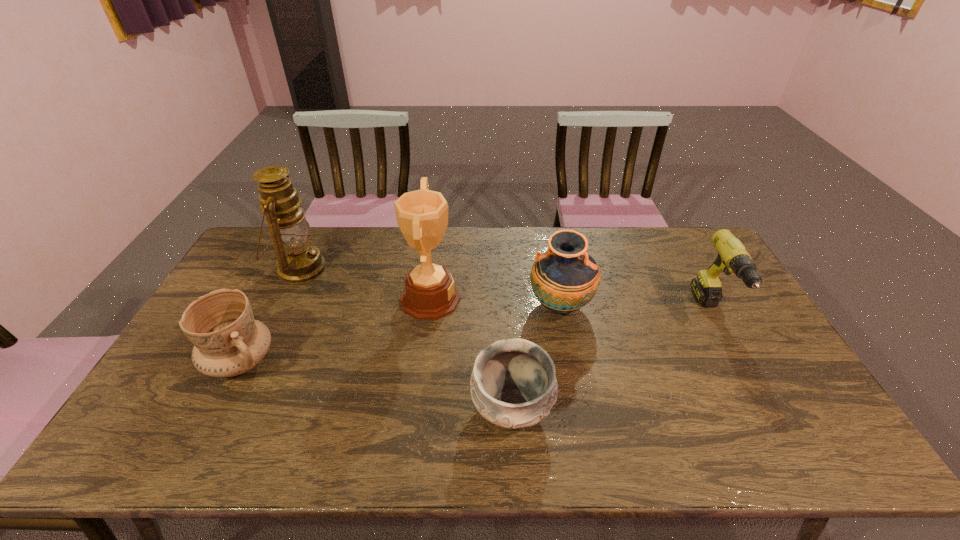
This screenshot has width=960, height=540. In order to click on free space between the shortest object and the oil lamp in this screenshot , I will do `click(406, 339)`.

Identify the location of free space that is in between the oil lamp and the shortest pottery. The height and width of the screenshot is (540, 960). (406, 339).

The width and height of the screenshot is (960, 540). I want to click on free space that is in between the drill and the second shortest pottery, so click(x=476, y=337).

The height and width of the screenshot is (540, 960). Find the location of `free area in between the farthest pottery and the second shortest object`. free area in between the farthest pottery and the second shortest object is located at coordinates (400, 334).

Choose which object is the second nearest neighbor to the oil lamp. Please provide its 2D coordinates. Your answer should be formatted as a tuple, i.e. [(x, y)], where the tuple contains the x and y coordinates of a point satisfying the conditions above.

[(430, 293)]

Locate which object ranks third in proximity to the tallest pottery. Please provide its 2D coordinates. Your answer should be formatted as a tuple, i.e. [(x, y)], where the tuple contains the x and y coordinates of a point satisfying the conditions above.

[(732, 257)]

Find the location of a particular element. The image size is (960, 540). pottery that is the second closest to the shortest pottery is located at coordinates (228, 341).

At what (x,y) coordinates should I click in order to perform the action: click on pottery that can be found as the third closest to the rightmost object. Please return your answer as a coordinate pair (x, y). Looking at the image, I should click on (228, 341).

What are the coordinates of `vacant point that satisfies the following two spatial constraints: 1. on the front-facing side of the third object from left to right; 2. on the right side of the farthest pottery` in the screenshot? It's located at [429, 306].

Find the location of a particular element. The image size is (960, 540). free space in the image that satisfies the following two spatial constraints: 1. on the back side of the farthest pottery; 2. on the front-facing side of the award is located at coordinates (559, 299).